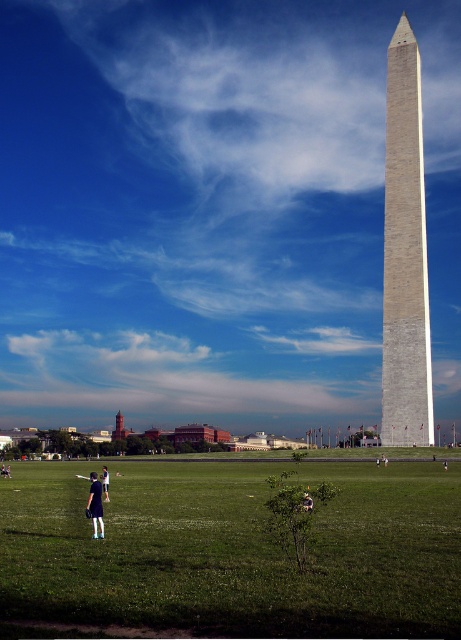
You are standing at point (95, 506) in the field. You want to walk to the Washington Monument on the right side of the frame. Which direction should you walk to avoid the dark blue dress at lower left?

The dark blue dress at lower left is located at point (95, 506). To reach the Washington Monument on the right side of the frame, you should walk towards the right direction away from the dark blue dress at lower left.

You are a photographer planning to capture a photo of the Washington Monument with the two people wearing the dark blue dress at lower left and the denim jacket at lower right. Since you want both subjects to appear equally sized in the final image, which direction should you move the camera relative to their current positions?

To make the dark blue dress at lower left and the denim jacket at lower right appear equally sized in the photo, you should move the camera closer to the denim jacket at lower right since the dark blue dress at lower left is larger in size and moving closer to the smaller denim jacket will balance their apparent sizes in the frame.